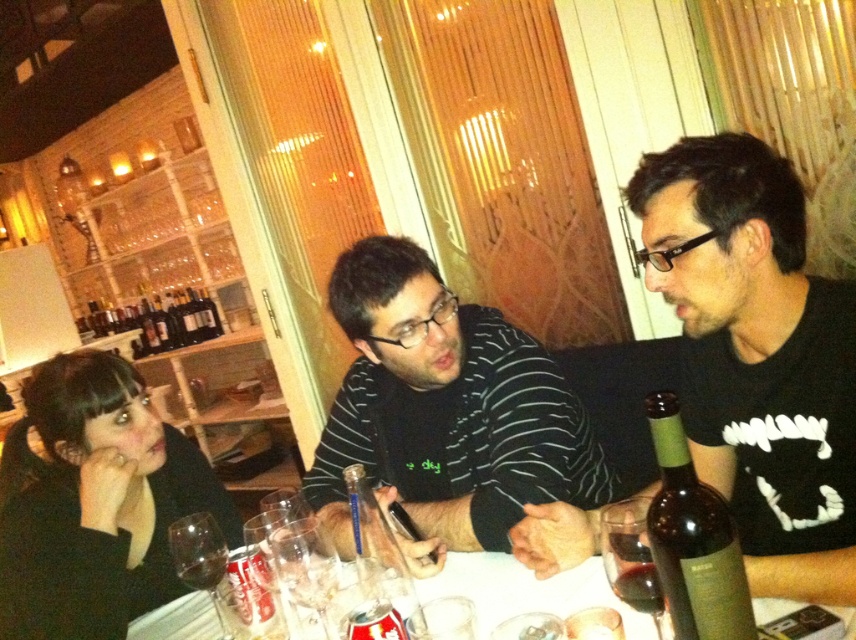
You are a waiter at the restaurant and need to place a new wine glass on the table. The existing wine glass is at point (201, 557). Where should you place the new glass to avoid it overlapping with the existing one?

Place the new wine glass away from the point (201, 557) to prevent overlapping with the existing transparent glass wine glass at lower left.

From the picture: You are a waiter in this scene. You need to place a new drink order for the woman on the left. Where should you place the drink relative to the transparent glass wine glass at lower left?

Place the new drink order to the right of the transparent glass wine glass at lower left since its current position is at point (201, 557), leaving space to the right.

You are a server at the restaurant and need to place a 12 inch long dessert plate between the black matte shirt at center and the translucent glass wine glass at table center. Can you fit it there without moving either object?

The distance between the black matte shirt at center and the translucent glass wine glass at table center is 14.28 inches. Since the dessert plate is 12 inches long, it can fit in the space between them.